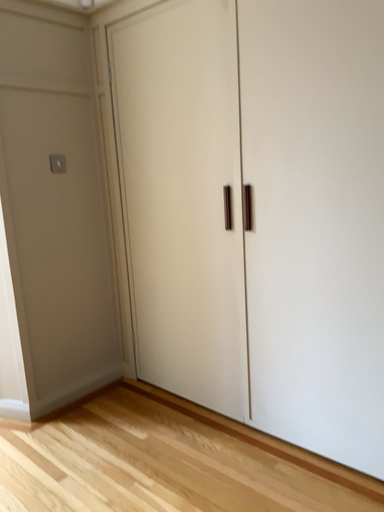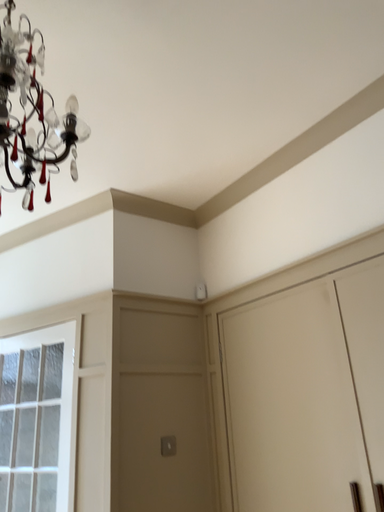
Question: Which way did the camera rotate in the video?

Choices:
 (A) rotated upward
 (B) rotated downward

Answer: (A)